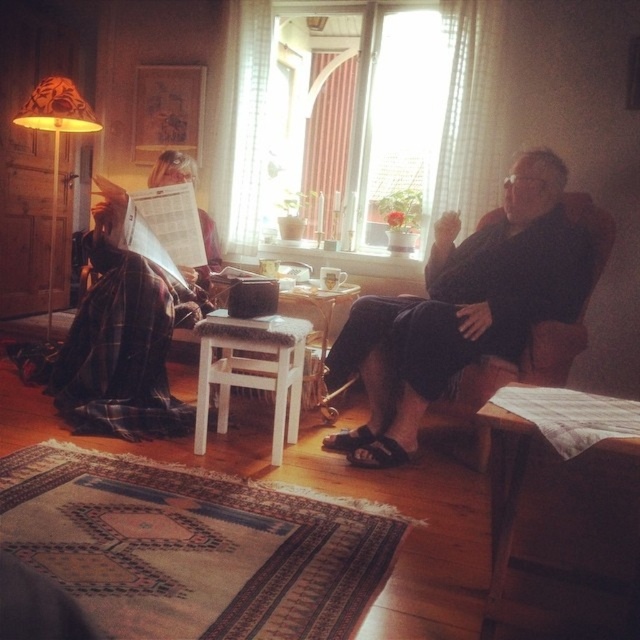
Is the position of white wooden stool at center less distant than that of orange fabric lampshade at left?

Yes, it is in front of orange fabric lampshade at left.

Is point (289, 339) positioned before point (88, 124)?

Yes, point (289, 339) is closer to viewer.

I want to click on white wooden stool at center, so click(252, 371).

Between point (268, 109) and point (48, 122), which one is positioned behind?

Point (268, 109)

Between translucent fabric window at center and orange fabric lampshade at left, which one appears on the left side from the viewer's perspective?

From the viewer's perspective, orange fabric lampshade at left appears more on the left side.

Find the location of a particular element. The height and width of the screenshot is (640, 640). translucent fabric window at center is located at coordinates (420, 124).

Where is `translucent fabric window at center`? translucent fabric window at center is located at coordinates (420, 124).

Between dark blue fabric chair at center and orange fabric lampshade at left, which one appears on the right side from the viewer's perspective?

dark blue fabric chair at center is more to the right.

Between point (538, 205) and point (42, 124), which one is positioned in front?

Point (538, 205) is in front.

Identify the location of dark blue fabric chair at center. (461, 308).